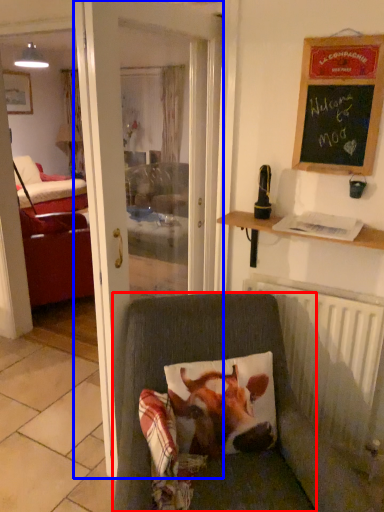
Question: Which of the following is the closest to the observer, chair (highlighted by a red box) or door (highlighted by a blue box)?

Choices:
 (A) chair
 (B) door

Answer: (A)